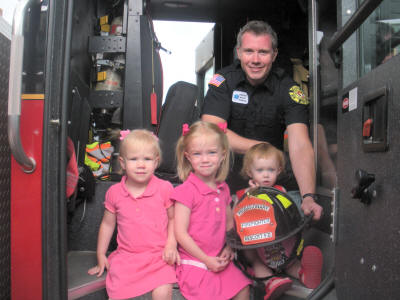
Locate where you'd adjust the window in the image. Your answer should be formatted as a list of tuples, i.e. [(x1, y1), (x2, y2), ...], where each tuple contains the x and y coordinates of a point satisfying the conditions above.

[(354, 192)]